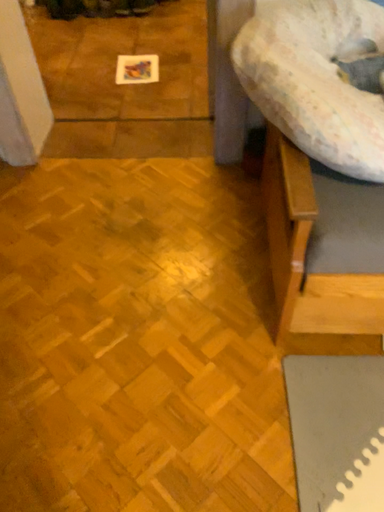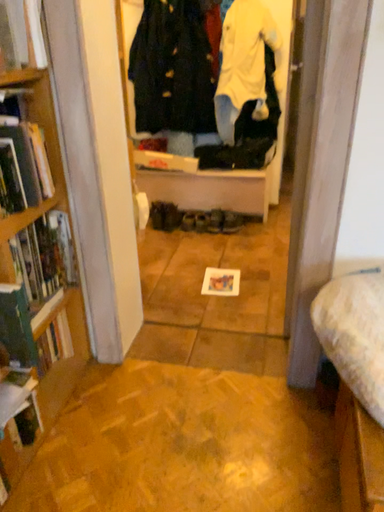
Question: Which way did the camera rotate in the video?

Choices:
 (A) rotated downward
 (B) rotated upward

Answer: (B)